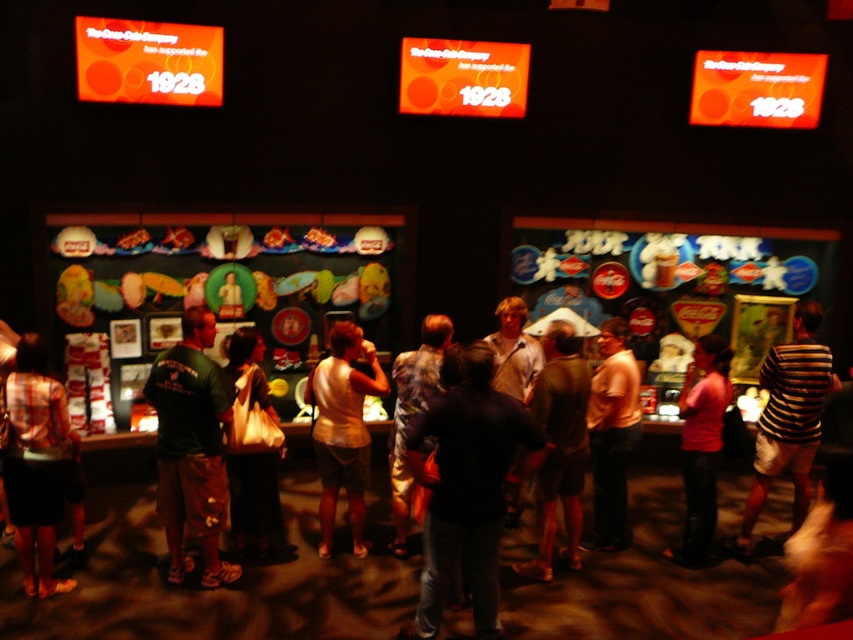
Question: Can you confirm if matte black skirt at lower left is positioned below striped t-shirt at center?

Choices:
 (A) no
 (B) yes

Answer: (B)

Question: Which of the following is the closest to the observer?

Choices:
 (A) dark gray pants at center
 (B) dark brown leather jacket at center
 (C) light beige tank top at center

Answer: (B)

Question: Which point is closer to the camera?

Choices:
 (A) green fabric shirt at left
 (B) striped t-shirt at center
 (C) matte black skirt at lower left
 (D) white fabric bag at center

Answer: (C)

Question: Is green fabric shirt at left below dark gray pants at center?

Choices:
 (A) yes
 (B) no

Answer: (B)

Question: Is green fabric shirt at left thinner than dark gray pants at center?

Choices:
 (A) no
 (B) yes

Answer: (A)

Question: Which object is closer to the camera taking this photo?

Choices:
 (A) light beige tank top at center
 (B) printed fabric dress at center

Answer: (B)